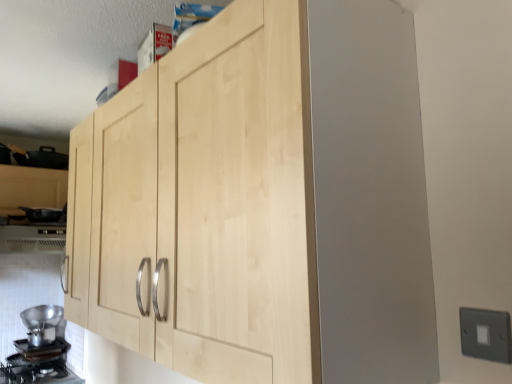
Measure the distance between point (474, 341) and camera.

Point (474, 341) and camera are 73.50 centimeters apart.

You are a GUI agent. You are given a task and a screenshot of the screen. Output one action in this format:
    pyautogui.click(x=<x>, y=<y>)
    Task: Click on the natural wood cabinet at center
    Image resolution: width=512 pixels, height=384 pixels.
    Given the screenshot: What is the action you would take?
    pyautogui.click(x=262, y=201)

This screenshot has width=512, height=384. In order to click on metallic silver funnel at lower left in this screenshot , I will do `click(42, 323)`.

Image resolution: width=512 pixels, height=384 pixels. I want to click on black matte gas stove at lower left, so click(x=38, y=364).

What is the approximate height of black matte gas stove at lower left?

The height of black matte gas stove at lower left is 2.49 inches.

This screenshot has height=384, width=512. I want to click on gray plastic switch at lower right, so click(x=486, y=334).

Considering the relative sizes of gray plastic switch at lower right and natural wood cabinet at center in the image provided, is gray plastic switch at lower right smaller than natural wood cabinet at center?

Indeed, gray plastic switch at lower right has a smaller size compared to natural wood cabinet at center.

From the picture: Can you confirm if gray plastic switch at lower right is shorter than natural wood cabinet at center?

Correct, gray plastic switch at lower right is not as tall as natural wood cabinet at center.

From the picture: Which point is more distant from viewer, (493,327) or (211,251)?

The point (211,251) is more distant.

Is gray plastic switch at lower right inside or outside of metallic silver funnel at lower left?

gray plastic switch at lower right lies outside metallic silver funnel at lower left.

From a real-world perspective, between gray plastic switch at lower right and metallic silver funnel at lower left, who is vertically higher?

From a 3D spatial view, gray plastic switch at lower right is above.

Is gray plastic switch at lower right in front of or behind metallic silver funnel at lower left in the image?

gray plastic switch at lower right is positioned closer to the viewer than metallic silver funnel at lower left.

What's the angular difference between gray plastic switch at lower right and metallic silver funnel at lower left's facing directions?

gray plastic switch at lower right and metallic silver funnel at lower left are facing 90 degrees away from each other.

Is natural wood cabinet at center wider or thinner than metallic silver funnel at lower left?

Clearly, natural wood cabinet at center has less width compared to metallic silver funnel at lower left.

Is natural wood cabinet at center positioned before metallic silver funnel at lower left?

Yes, it is.

Would you say natural wood cabinet at center is inside or outside metallic silver funnel at lower left?

natural wood cabinet at center is not enclosed by metallic silver funnel at lower left.

Is natural wood cabinet at center positioned with its back to metallic silver funnel at lower left?

That's not correct — natural wood cabinet at center is not looking away from metallic silver funnel at lower left.

Does black matte gas stove at lower left turn towards gray plastic switch at lower right?

No, black matte gas stove at lower left is not aimed at gray plastic switch at lower right.

Between black matte gas stove at lower left and gray plastic switch at lower right, which one has smaller size?

gray plastic switch at lower right.

Who is taller, black matte gas stove at lower left or gray plastic switch at lower right?

With more height is gray plastic switch at lower right.

Looking at this image, would you say black matte gas stove at lower left is outside gray plastic switch at lower right?

black matte gas stove at lower left lies outside gray plastic switch at lower right's area.

Is metallic silver funnel at lower left not close to black matte gas stove at lower left?

That's not correct — metallic silver funnel at lower left is a little close to black matte gas stove at lower left.

Image resolution: width=512 pixels, height=384 pixels. Find the location of `appliance above the black matte gas stove at lower left (from the image's perspective)`. appliance above the black matte gas stove at lower left (from the image's perspective) is located at coordinates (42, 323).

Is metallic silver funnel at lower left positioned behind black matte gas stove at lower left?

Yes.

From their relative heights in the image, would you say metallic silver funnel at lower left is taller or shorter than black matte gas stove at lower left?

metallic silver funnel at lower left is taller than black matte gas stove at lower left.

From the image's perspective, which one is positioned lower, metallic silver funnel at lower left or gray plastic switch at lower right?

metallic silver funnel at lower left.

Which is closer, (40,324) or (499,339)?

Positioned in front is point (499,339).

Which object is closer to the camera, metallic silver funnel at lower left or gray plastic switch at lower right?

gray plastic switch at lower right is closer to the camera.

In the scene shown: Would you say metallic silver funnel at lower left is to the left or to the right of gray plastic switch at lower right in the picture?

metallic silver funnel at lower left is positioned on gray plastic switch at lower right's left side.

In terms of width, does metallic silver vent at lower left look wider or thinner when compared to metallic silver funnel at lower left?

metallic silver vent at lower left is wider than metallic silver funnel at lower left.

Is point (14, 235) closer to viewer compared to point (48, 314)?

Yes, it is.

Identify the location of vent in front of the metallic silver funnel at lower left. (32, 239).

In the scene shown: Which of these two, metallic silver vent at lower left or metallic silver funnel at lower left, is smaller?

metallic silver funnel at lower left.

Locate an element on the screen. This screenshot has height=384, width=512. cupboard located on the left of gray plastic switch at lower right is located at coordinates (262, 201).

Find the location of a particular element. electric outlet above the metallic silver funnel at lower left (from the image's perspective) is located at coordinates (486, 334).

Looking at the image, which one is located further to natural wood cabinet at center, gray plastic switch at lower right or metallic silver vent at lower left?

Based on the image, metallic silver vent at lower left appears to be further to natural wood cabinet at center.

Which object lies further to the anchor point natural wood cabinet at center, metallic silver vent at lower left or metallic silver funnel at lower left?

The object further to natural wood cabinet at center is metallic silver funnel at lower left.

From the image, which object appears to be farther from metallic silver funnel at lower left, natural wood cabinet at center or black matte gas stove at lower left?

natural wood cabinet at center lies further to metallic silver funnel at lower left than the other object.

Based on their spatial positions, is black matte gas stove at lower left or metallic silver funnel at lower left closer to natural wood cabinet at center?

black matte gas stove at lower left.

Looking at the image, which one is located further to black matte gas stove at lower left, gray plastic switch at lower right or metallic silver funnel at lower left?

The object further to black matte gas stove at lower left is gray plastic switch at lower right.

From the image, which object appears to be farther from black matte gas stove at lower left, gray plastic switch at lower right or natural wood cabinet at center?

gray plastic switch at lower right is further to black matte gas stove at lower left.

Estimate the real-world distances between objects in this image. Which object is further from metallic silver vent at lower left, natural wood cabinet at center or black matte gas stove at lower left?

natural wood cabinet at center lies further to metallic silver vent at lower left than the other object.

Considering their positions, is metallic silver vent at lower left positioned closer to black matte gas stove at lower left than gray plastic switch at lower right?

metallic silver vent at lower left is positioned closer to the anchor black matte gas stove at lower left.

In order to click on vent located between natural wood cabinet at center and metallic silver funnel at lower left in the depth direction in this screenshot , I will do `click(32, 239)`.

At what (x,y) coordinates should I click in order to perform the action: click on gas stove between natural wood cabinet at center and metallic silver vent at lower left along the z-axis. Please return your answer as a coordinate pair (x, y). Looking at the image, I should click on (38, 364).

The height and width of the screenshot is (384, 512). Find the location of `gas stove between natural wood cabinet at center and metallic silver funnel at lower left from front to back`. gas stove between natural wood cabinet at center and metallic silver funnel at lower left from front to back is located at coordinates (38, 364).

Locate an element on the screen. The image size is (512, 384). electric outlet located between natural wood cabinet at center and black matte gas stove at lower left in the depth direction is located at coordinates (486, 334).